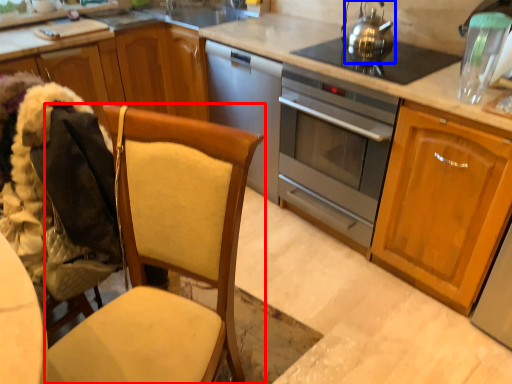
Question: Which point is closer to the camera, chair (highlighted by a red box) or tea pot (highlighted by a blue box)?

Choices:
 (A) chair
 (B) tea pot

Answer: (A)